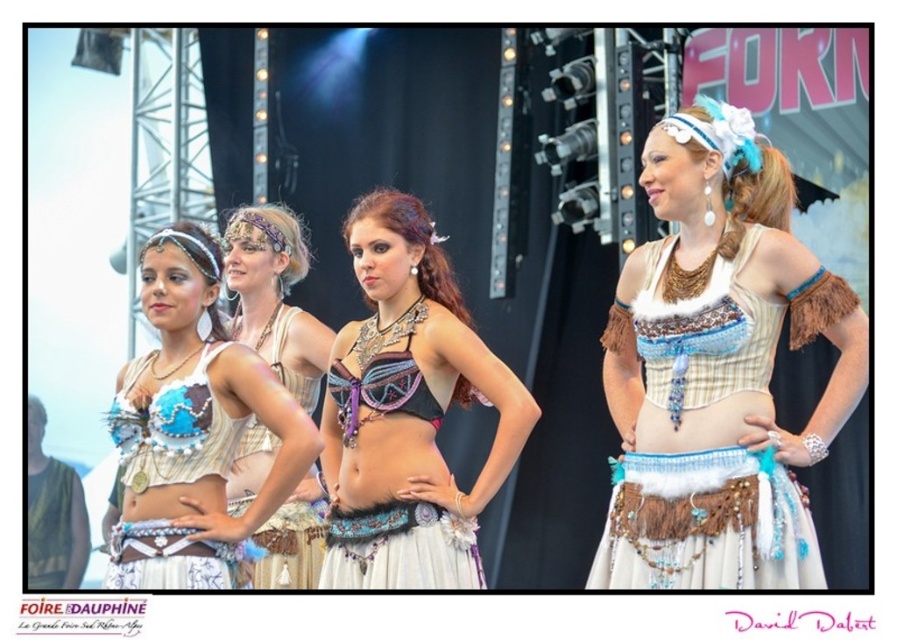
Question: Does shiny purple fabric bra at center appear over matte white fabric at center?

Choices:
 (A) no
 (B) yes

Answer: (B)

Question: Which point is farther to the camera?

Choices:
 (A) (443, 355)
 (B) (172, 467)

Answer: (A)

Question: Is beige textured top at center closer to the viewer compared to matte white fabric at center?

Choices:
 (A) no
 (B) yes

Answer: (B)

Question: Which is farther from the shiny purple fabric bra at center?

Choices:
 (A) matte blue fabric bra at left
 (B) matte white fabric at center

Answer: (A)

Question: Which of the following is the farthest from the observer?

Choices:
 (A) matte blue fabric bra at left
 (B) matte beige bra at center

Answer: (B)

Question: Is shiny purple fabric bra at center further to camera compared to matte blue fabric bra at left?

Choices:
 (A) yes
 (B) no

Answer: (A)